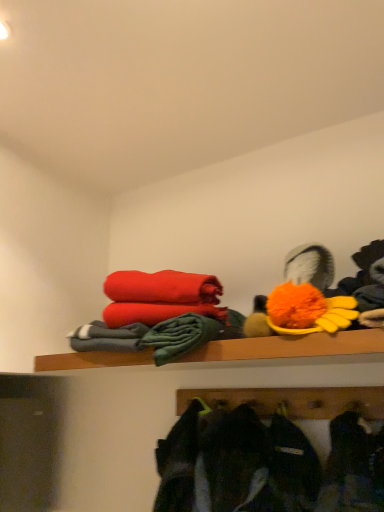
Describe the element at coordinates (290, 347) in the screenshot. This screenshot has width=384, height=512. I see `wooden shelf at upper center` at that location.

Identify the location of wooden shelf at upper center. The height and width of the screenshot is (512, 384). (290, 347).

Can you tell me how much fluffy orange pom-pom at upper right and dark gray fabric jacket at lower center differ in facing direction?

There is a 1.43-degree angle between the facing directions of fluffy orange pom-pom at upper right and dark gray fabric jacket at lower center.

Is fluffy orange pom-pom at upper right positioned with its back to dark gray fabric jacket at lower center?

fluffy orange pom-pom at upper right does not have its back to dark gray fabric jacket at lower center.

Identify the location of clothing on the left side of fluffy orange pom-pom at upper right. The image size is (384, 512). (266, 464).

How much distance is there between wooden shelf at upper center and fluffy orange pom-pom at upper right?

wooden shelf at upper center and fluffy orange pom-pom at upper right are 6.32 inches apart.

Could you tell me if wooden shelf at upper center is facing fluffy orange pom-pom at upper right?

No, wooden shelf at upper center is not turned towards fluffy orange pom-pom at upper right.

Based on the photo, how many degrees apart are the facing directions of wooden shelf at upper center and fluffy orange pom-pom at upper right?

wooden shelf at upper center and fluffy orange pom-pom at upper right are facing 3.64 degrees away from each other.

Who is shorter, wooden shelf at upper center or fluffy orange pom-pom at upper right?

Standing shorter between the two is wooden shelf at upper center.

Would you say wooden shelf at upper center is a long distance from dark gray fabric jacket at lower center?

No, wooden shelf at upper center is not far from dark gray fabric jacket at lower center.

Between wooden shelf at upper center and dark gray fabric jacket at lower center, which one appears on the left side from the viewer's perspective?

wooden shelf at upper center.

Image resolution: width=384 pixels, height=512 pixels. I want to click on shelf above the dark gray fabric jacket at lower center (from a real-world perspective), so click(290, 347).

Which is more to the right, fluffy orange pom-pom at upper right or wooden shelf at upper center?

fluffy orange pom-pom at upper right is more to the right.

Is fluffy orange pom-pom at upper right oriented towards wooden shelf at upper center?

No, fluffy orange pom-pom at upper right is not turned towards wooden shelf at upper center.

From the picture: From the image's perspective, does fluffy orange pom-pom at upper right appear higher than wooden shelf at upper center?

Yes, from the image's perspective, fluffy orange pom-pom at upper right is over wooden shelf at upper center.

From the image's perspective, who appears lower, dark gray fabric jacket at lower center or fluffy orange pom-pom at upper right?

dark gray fabric jacket at lower center is shown below in the image.

Between dark gray fabric jacket at lower center and fluffy orange pom-pom at upper right, which one is positioned behind?

fluffy orange pom-pom at upper right is more distant.

Is dark gray fabric jacket at lower center oriented towards fluffy orange pom-pom at upper right?

No, dark gray fabric jacket at lower center is not turned towards fluffy orange pom-pom at upper right.

Does dark gray fabric jacket at lower center have a lesser width compared to wooden shelf at upper center?

Incorrect, the width of dark gray fabric jacket at lower center is not less than that of wooden shelf at upper center.

How far apart are dark gray fabric jacket at lower center and wooden shelf at upper center?

They are 12.34 inches apart.

Which of these two, dark gray fabric jacket at lower center or wooden shelf at upper center, stands taller?

With more height is dark gray fabric jacket at lower center.

This screenshot has height=512, width=384. In order to click on toy lying above the dark gray fabric jacket at lower center (from the image's perspective) in this screenshot , I will do `click(302, 298)`.

Identify the location of shelf that appears below the fluffy orange pom-pom at upper right (from the image's perspective). (290, 347).

Estimate the real-world distances between objects in this image. Which object is closer to fluffy orange pom-pom at upper right, dark gray fabric jacket at lower center or wooden shelf at upper center?

wooden shelf at upper center.

Estimate the real-world distances between objects in this image. Which object is further from fluffy orange pom-pom at upper right, wooden shelf at upper center or dark gray fabric jacket at lower center?

dark gray fabric jacket at lower center lies further to fluffy orange pom-pom at upper right than the other object.

Based on their spatial positions, is wooden shelf at upper center or fluffy orange pom-pom at upper right further from dark gray fabric jacket at lower center?

Based on the image, fluffy orange pom-pom at upper right appears to be further to dark gray fabric jacket at lower center.

Considering their positions, is fluffy orange pom-pom at upper right positioned further to dark gray fabric jacket at lower center than wooden shelf at upper center?

fluffy orange pom-pom at upper right is positioned further to the anchor dark gray fabric jacket at lower center.

Estimate the real-world distances between objects in this image. Which object is closer to wooden shelf at upper center, fluffy orange pom-pom at upper right or dark gray fabric jacket at lower center?

fluffy orange pom-pom at upper right.

Based on their spatial positions, is dark gray fabric jacket at lower center or fluffy orange pom-pom at upper right further from wooden shelf at upper center?

dark gray fabric jacket at lower center lies further to wooden shelf at upper center than the other object.

What are the coordinates of `shelf between fluffy orange pom-pom at upper right and dark gray fabric jacket at lower center vertically` in the screenshot? It's located at (290, 347).